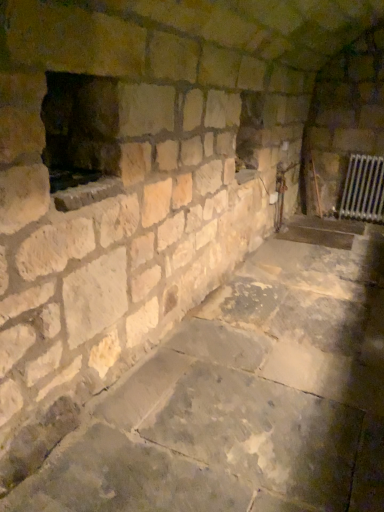
What do you see at coordinates (363, 189) in the screenshot? I see `white metallic radiator at right` at bounding box center [363, 189].

This screenshot has width=384, height=512. I want to click on white metallic radiator at right, so click(x=363, y=189).

I want to click on white metallic radiator at right, so click(363, 189).